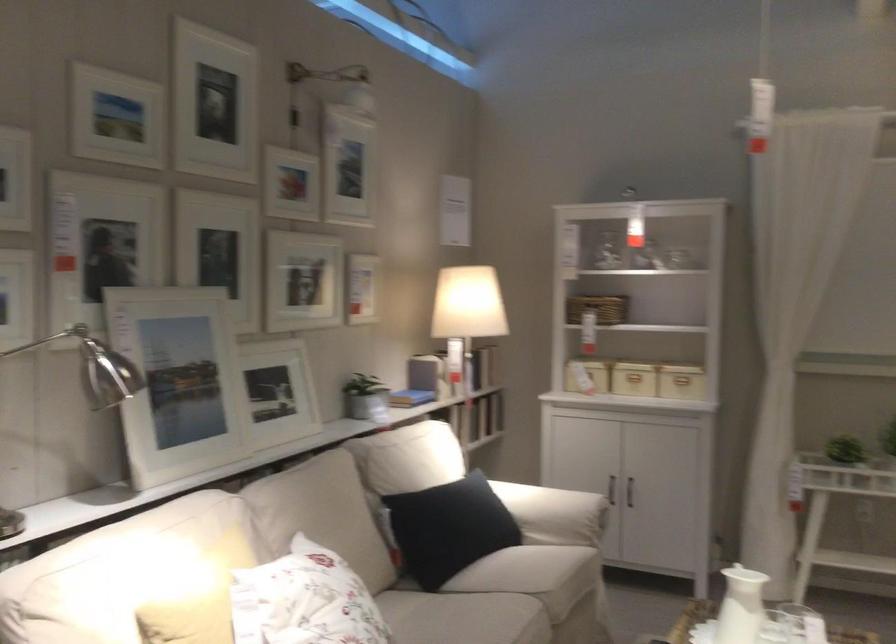
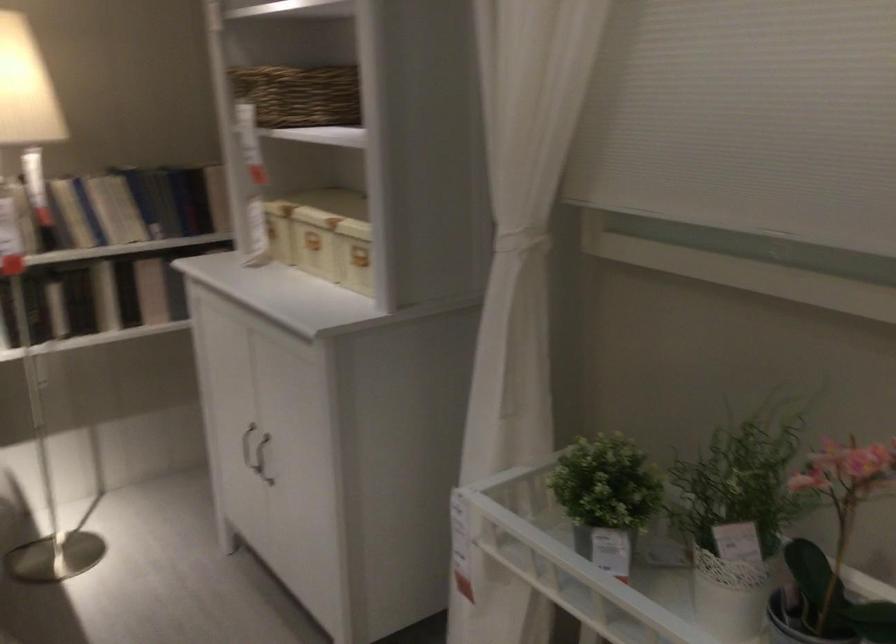
The point at (460, 368) is marked in the first image. Where is the corresponding point in the second image?

(71, 213)